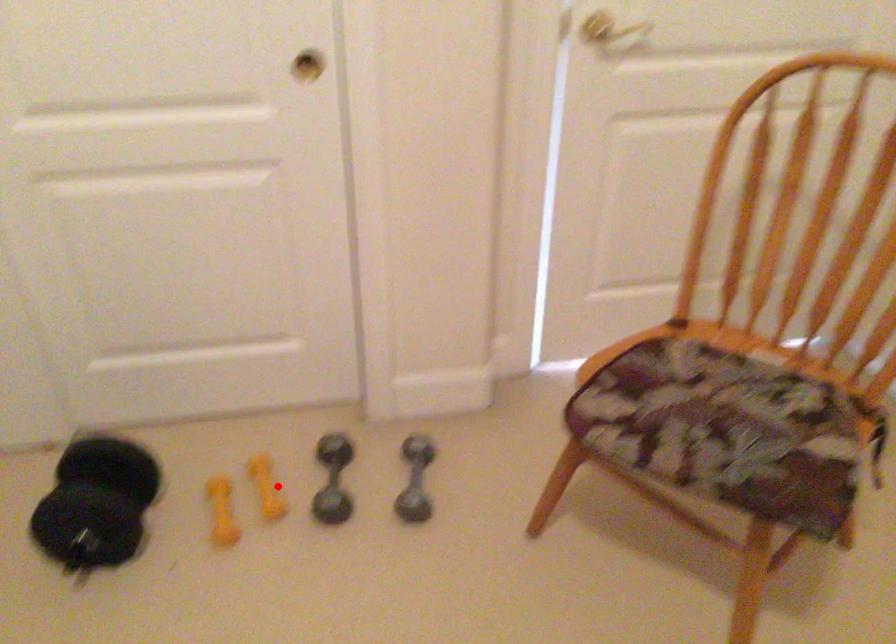
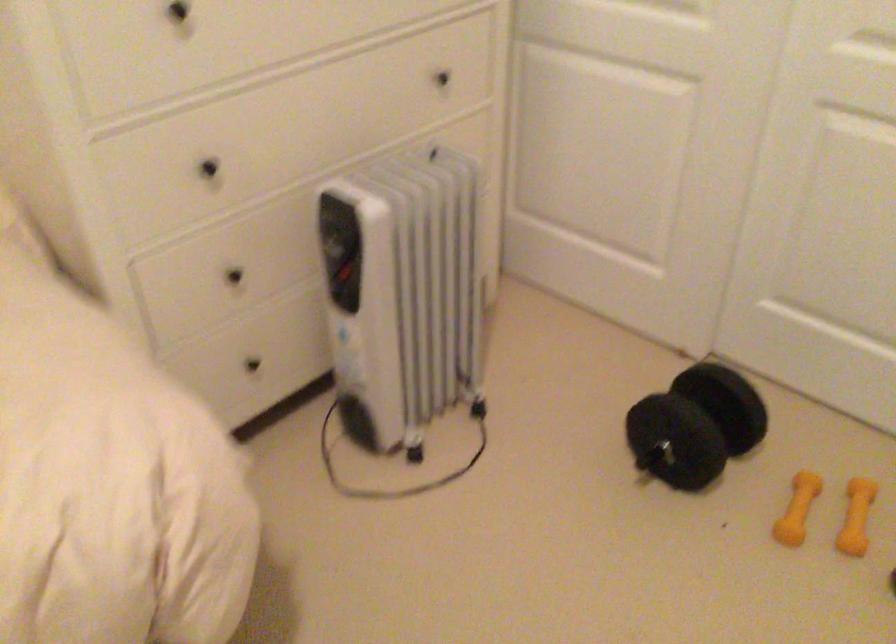
The point at the highlighted location is marked in the first image. Where is the corresponding point in the second image?

(856, 516)